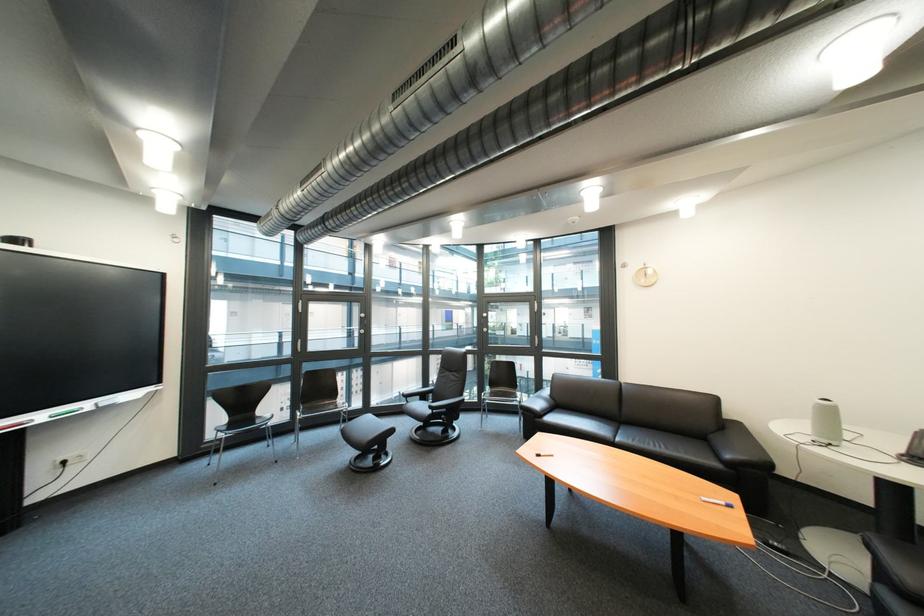
What do you see at coordinates (538, 403) in the screenshot? I see `the black chair armrest` at bounding box center [538, 403].